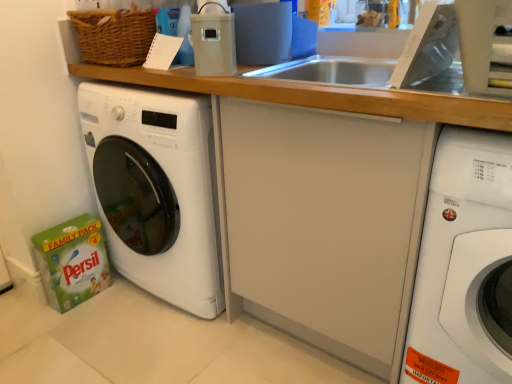
Question: Relative to white glossy washing machine at left, the second washing machine when ordered from right to left, is white glossy washing machine at right, positioned as the first washing machine in right-to-left order, in front or behind?

Choices:
 (A) front
 (B) behind

Answer: (A)

Question: Is white glossy washing machine at right, positioned as the first washing machine in right-to-left order, bigger or smaller than white glossy washing machine at left, the second washing machine when ordered from right to left?

Choices:
 (A) big
 (B) small

Answer: (B)

Question: Based on their relative distances, which object is nearer to the matte plastic container at upper center?

Choices:
 (A) white glossy washing machine at right, acting as the 2th washing machine starting from the left
 (B) white glossy washing machine at left, which is the first washing machine in left-to-right order

Answer: (B)

Question: Considering the real-world distances, which object is closest to the white glossy washing machine at right, acting as the 2th washing machine starting from the left?

Choices:
 (A) white glossy washing machine at left, which is the first washing machine in left-to-right order
 (B) matte plastic container at upper center

Answer: (B)